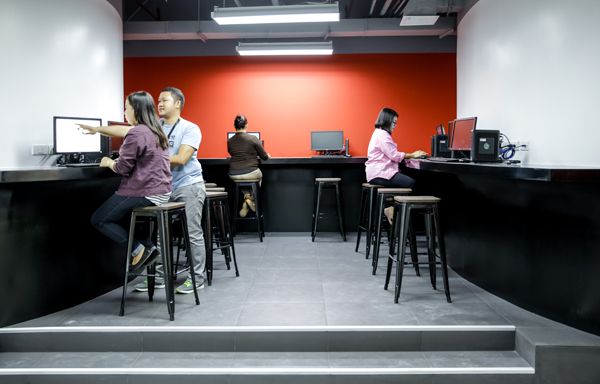
Image resolution: width=600 pixels, height=384 pixels. Identify the location of computer monitors. (460, 134), (318, 133), (257, 137), (72, 137).